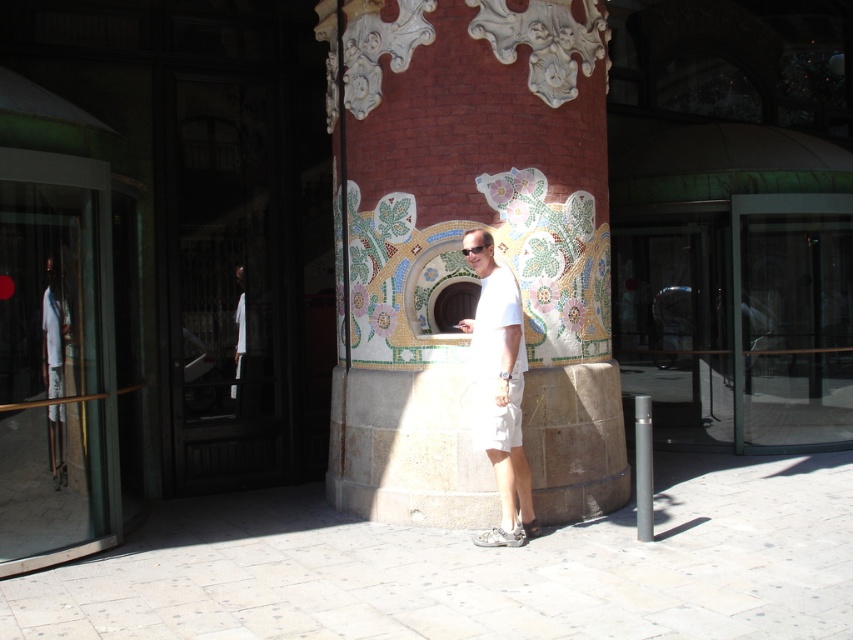
Question: Which point is closer to the camera?

Choices:
 (A) transparent glass door at left
 (B) transparent glass door at center

Answer: (A)

Question: Which object appears farthest from the camera in this image?

Choices:
 (A) mosaic tile column at center
 (B) matte black goggles at center
 (C) white cotton shirt at left
 (D) white cotton shirt at center

Answer: (C)

Question: Is transparent glass door at center to the left of white cotton shirt at center from the viewer's perspective?

Choices:
 (A) yes
 (B) no

Answer: (B)

Question: Considering the relative positions of transparent glass door at center and matte black goggles at center in the image provided, where is transparent glass door at center located with respect to matte black goggles at center?

Choices:
 (A) left
 (B) right

Answer: (B)

Question: Which point is farther to the camera?

Choices:
 (A) matte black goggles at center
 (B) mosaic tile column at center

Answer: (B)

Question: Does transparent glass door at left have a greater width compared to white cotton shirt at center?

Choices:
 (A) no
 (B) yes

Answer: (B)